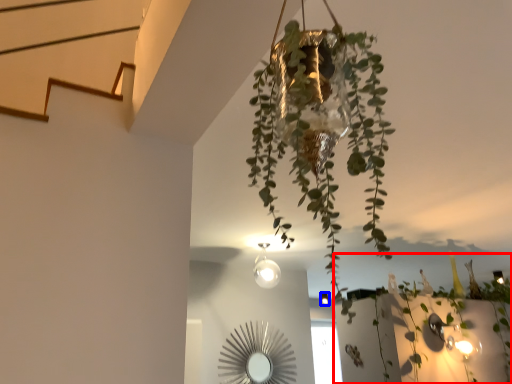
Question: Which object appears closest to the camera in this image, plant (highlighted by a red box) or light fixture (highlighted by a blue box)?

Choices:
 (A) plant
 (B) light fixture

Answer: (A)